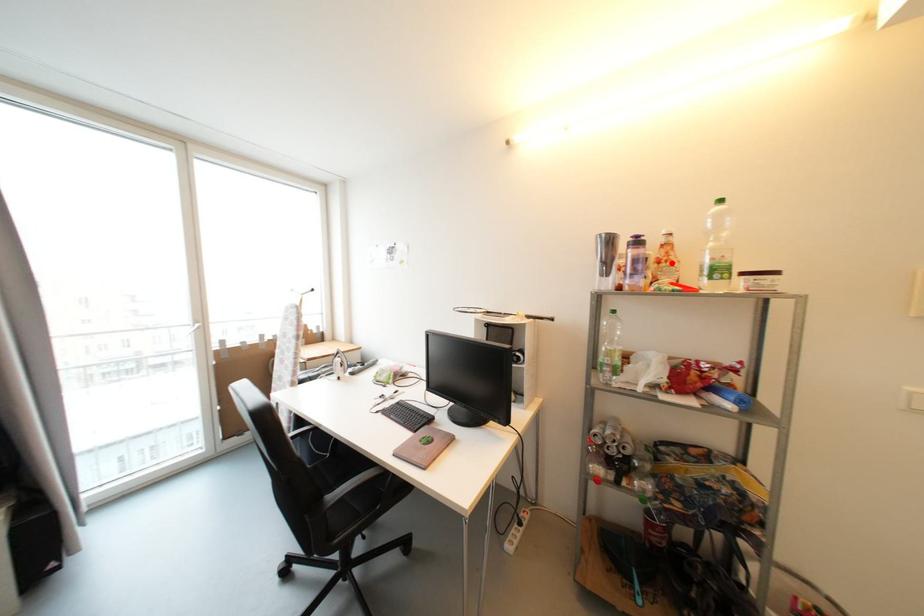
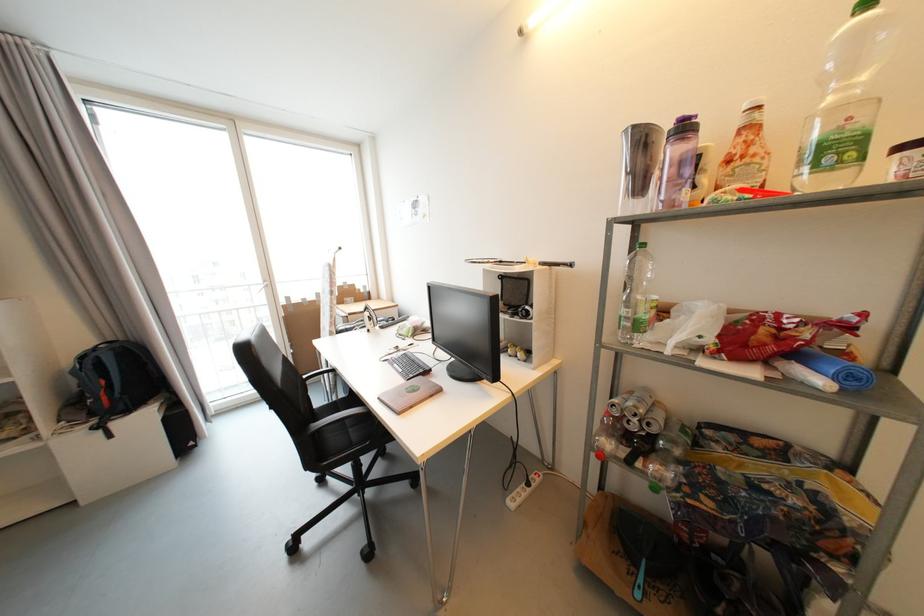
Locate, in the second image, the point that corresponds to the highlighted location in the first image.

(748, 159)